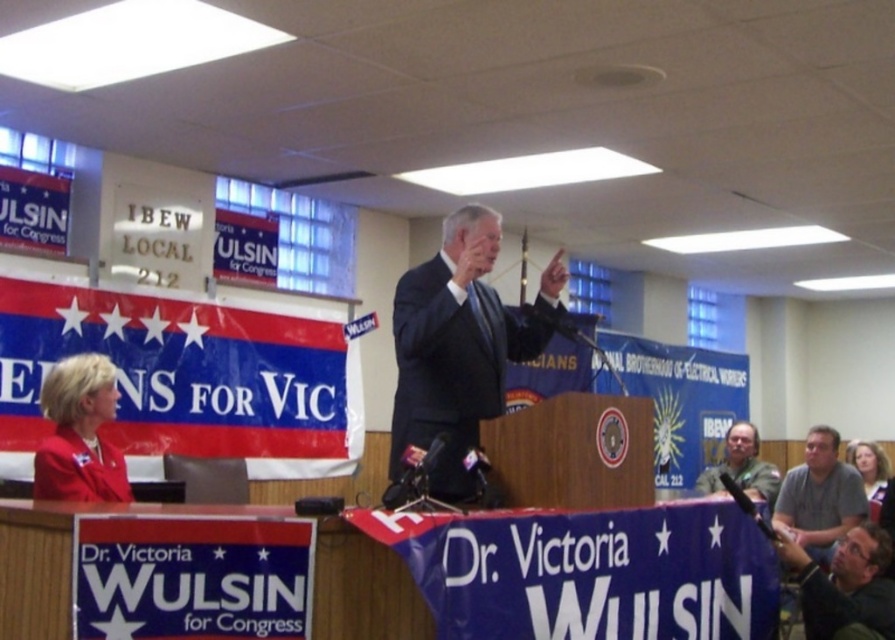
Who is higher up, dark suit at center or gray casual shirt at lower right?

dark suit at center

Is dark suit at center wider than gray casual shirt at lower right?

Indeed, dark suit at center has a greater width compared to gray casual shirt at lower right.

The height and width of the screenshot is (640, 895). What do you see at coordinates (455, 348) in the screenshot?
I see `dark suit at center` at bounding box center [455, 348].

You are a GUI agent. You are given a task and a screenshot of the screen. Output one action in this format:
    pyautogui.click(x=<x>, y=<y>)
    Task: Click on the dark suit at center
    
    Given the screenshot: What is the action you would take?
    pyautogui.click(x=455, y=348)

Can you confirm if matte red blouse at lower left is taller than dark gray shirt at lower right?

Yes.

This screenshot has height=640, width=895. What do you see at coordinates (79, 433) in the screenshot?
I see `matte red blouse at lower left` at bounding box center [79, 433].

Locate an element on the screen. matte red blouse at lower left is located at coordinates (79, 433).

Does point (814, 442) come closer to viewer compared to point (739, 484)?

Yes, point (814, 442) is in front of point (739, 484).

Between gray casual shirt at lower right and green fabric shirt at lower right, which one has more height?

gray casual shirt at lower right

Which is behind, point (782, 492) or point (774, 484)?

The point (774, 484) is more distant.

Where is `gray casual shirt at lower right`? gray casual shirt at lower right is located at coordinates (820, 497).